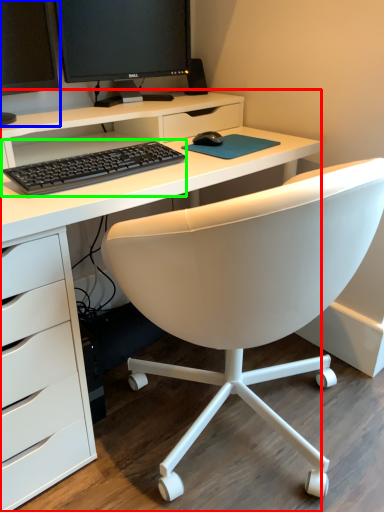
Question: Which is farther away from desk (highlighted by a red box)? computer monitor (highlighted by a blue box) or computer keyboard (highlighted by a green box)?

Choices:
 (A) computer monitor
 (B) computer keyboard

Answer: (A)